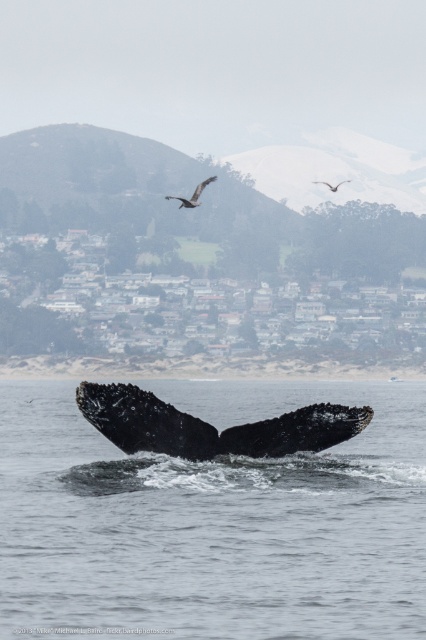
In the scene shown: Is dark brown feathered bird at upper center positioned before brown feathered eagle at upper center?

Yes.

Which is below, dark brown feathered bird at upper center or brown feathered eagle at upper center?

dark brown feathered bird at upper center

The image size is (426, 640). What do you see at coordinates (193, 193) in the screenshot? I see `dark brown feathered bird at upper center` at bounding box center [193, 193].

The width and height of the screenshot is (426, 640). In order to click on dark brown feathered bird at upper center in this screenshot , I will do `click(193, 193)`.

Is black matte water at lower center smaller than black textured whale tail at center?

Actually, black matte water at lower center might be larger than black textured whale tail at center.

Locate an element on the screen. Image resolution: width=426 pixels, height=640 pixels. black matte water at lower center is located at coordinates (213, 522).

The image size is (426, 640). In order to click on black matte water at lower center in this screenshot , I will do `click(213, 522)`.

Does point (310, 429) come farther from viewer compared to point (196, 192)?

No, it is in front of (196, 192).

Is black textured whale tail at center taller than dark brown feathered bird at upper center?

Incorrect, black textured whale tail at center's height is not larger of dark brown feathered bird at upper center's.

Locate an element on the screen. The width and height of the screenshot is (426, 640). black textured whale tail at center is located at coordinates (210, 426).